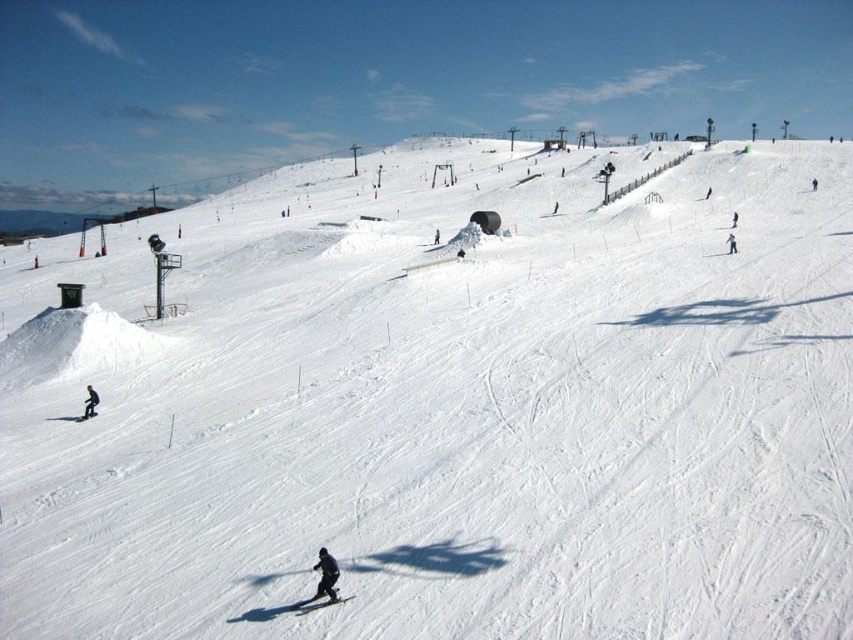
You are a photographer trying to capture a wide shot of the ski resort scene. You notice two snowboarders at the center of the image labeled as the dark blue snowboarder at center and the black matte snowboarder at center. Considering their widths, which one would appear larger in your photo?

The dark blue snowboarder at center would appear larger in the photo since its width surpasses that of the black matte snowboarder at center.